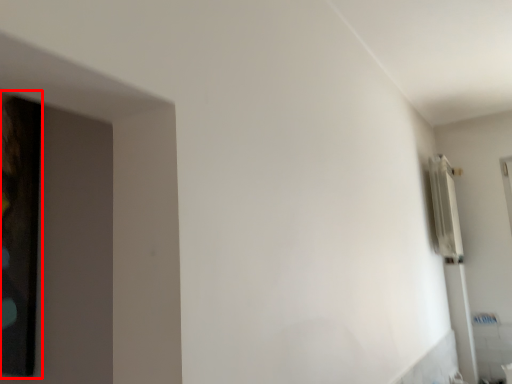
Question: Where is picture frame (annotated by the red box) located in relation to radiator in the image?

Choices:
 (A) left
 (B) right

Answer: (A)